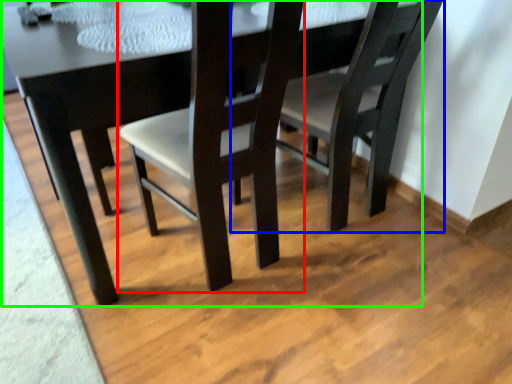
Question: Which object is the closest to the chair (highlighted by a red box)? Choose among these: chair (highlighted by a blue box) or table (highlighted by a green box).

Choices:
 (A) chair
 (B) table

Answer: (B)